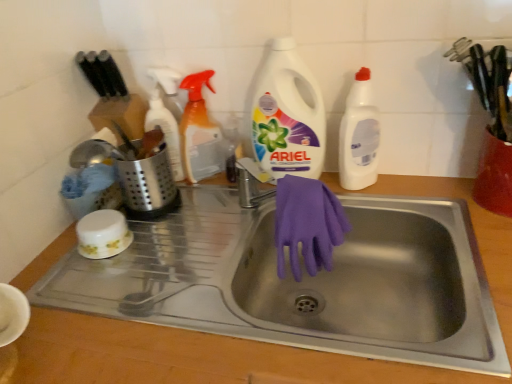
The width and height of the screenshot is (512, 384). What do you see at coordinates (359, 135) in the screenshot?
I see `white plastic bottle at upper right, the 1th cleaning product in the right-to-left sequence` at bounding box center [359, 135].

Measure the distance between point [144,207] and camera.

Point [144,207] is 37.17 inches from camera.

The image size is (512, 384). I want to click on satin silver utensil holder at left, marked as the 1th appliance in a left-to-right arrangement, so click(x=148, y=185).

How much space does red plastic container at upper right, the second appliance viewed from the left, occupy vertically?

6.27 inches.

You are a GUI agent. You are given a task and a screenshot of the screen. Output one action in this format:
    pyautogui.click(x=<x>, y=<y>)
    Task: Click on the purple rubber gloves at sink
    The width and height of the screenshot is (512, 384).
    Given the screenshot: What is the action you would take?
    pyautogui.click(x=307, y=224)

The width and height of the screenshot is (512, 384). What are the coordinates of `white plastic bottle at upper right, which is counted as the fourth cleaning product, starting from the left` in the screenshot? It's located at (359, 135).

Who is more distant, stainless steel sink at center or white plastic bottle at upper right, the 1th cleaning product in the right-to-left sequence?

white plastic bottle at upper right, the 1th cleaning product in the right-to-left sequence, is further away from the camera.

From the picture: Could you tell me if stainless steel sink at center is facing white plastic bottle at upper right, the 1th cleaning product in the right-to-left sequence?

No, stainless steel sink at center is not facing towards white plastic bottle at upper right, the 1th cleaning product in the right-to-left sequence.

Between stainless steel sink at center and white plastic bottle at upper right, which is counted as the fourth cleaning product, starting from the left, which one has smaller width?

white plastic bottle at upper right, which is counted as the fourth cleaning product, starting from the left, is thinner.

From the image's perspective, which object appears higher, stainless steel sink at center or white plastic bottle at upper right, which is counted as the fourth cleaning product, starting from the left?

From the image's view, white plastic bottle at upper right, which is counted as the fourth cleaning product, starting from the left, is above.

Considering the points (168, 83) and (189, 155), which point is behind, point (168, 83) or point (189, 155)?

The point (168, 83) is behind.

You are a GUI agent. You are given a task and a screenshot of the screen. Output one action in this format:
    pyautogui.click(x=<x>, y=<y>)
    Task: Click on the cleaning product directly beneath the translucent orange spray bottle at upper center, marked as the third cleaning product in a right-to-left arrangement (from a real-world perspective)
    The height and width of the screenshot is (384, 512).
    Given the screenshot: What is the action you would take?
    click(x=165, y=116)

Is translucent orange spray bottle at upper center, which appears as the second cleaning product when viewed from the left, at the back of translucent plastic spray bottle at upper center, positioned as the fourth cleaning product in right-to-left order?

That's not correct — translucent plastic spray bottle at upper center, positioned as the fourth cleaning product in right-to-left order, is not looking away from translucent orange spray bottle at upper center, which appears as the second cleaning product when viewed from the left.

Who is smaller, translucent plastic spray bottle at upper center, positioned as the 1th cleaning product in left-to-right order, or translucent orange spray bottle at upper center, marked as the third cleaning product in a right-to-left arrangement?

translucent plastic spray bottle at upper center, positioned as the 1th cleaning product in left-to-right order, is smaller.

Based on their positions, is white plastic detergent at center, marked as the 3th cleaning product in a left-to-right arrangement, located to the left or right of purple rubber gloves at sink?

white plastic detergent at center, marked as the 3th cleaning product in a left-to-right arrangement, is to the left of purple rubber gloves at sink.

Looking at this image, is white plastic detergent at center, acting as the 2th cleaning product starting from the right, taller than purple rubber gloves at sink?

Yes.

Is white plastic detergent at center, marked as the 3th cleaning product in a left-to-right arrangement, not within purple rubber gloves at sink?

That's correct, white plastic detergent at center, marked as the 3th cleaning product in a left-to-right arrangement, is outside of purple rubber gloves at sink.

Considering the sizes of objects stainless steel sink at center and translucent orange spray bottle at upper center, marked as the third cleaning product in a right-to-left arrangement, in the image provided, who is smaller, stainless steel sink at center or translucent orange spray bottle at upper center, marked as the third cleaning product in a right-to-left arrangement,?

translucent orange spray bottle at upper center, marked as the third cleaning product in a right-to-left arrangement.

From a real-world perspective, is stainless steel sink at center positioned under translucent orange spray bottle at upper center, which appears as the second cleaning product when viewed from the left, based on gravity?

Yes.

Is stainless steel sink at center looking in the opposite direction of translucent orange spray bottle at upper center, marked as the third cleaning product in a right-to-left arrangement?

No, stainless steel sink at center is not facing the opposite direction of translucent orange spray bottle at upper center, marked as the third cleaning product in a right-to-left arrangement.

Which object is further away from the camera, stainless steel sink at center or translucent orange spray bottle at upper center, which appears as the second cleaning product when viewed from the left?

translucent orange spray bottle at upper center, which appears as the second cleaning product when viewed from the left, is further away from the camera.

Is translucent plastic spray bottle at upper center, positioned as the 1th cleaning product in left-to-right order, turned away from white plastic detergent at center, acting as the 2th cleaning product starting from the right?

No.

Which is closer, (173, 156) or (314, 153)?

Positioned in front is point (314, 153).

Considering the relative positions of translucent plastic spray bottle at upper center, positioned as the 1th cleaning product in left-to-right order, and white plastic detergent at center, acting as the 2th cleaning product starting from the right, in the image provided, is translucent plastic spray bottle at upper center, positioned as the 1th cleaning product in left-to-right order, behind white plastic detergent at center, acting as the 2th cleaning product starting from the right,?

Yes, it is.

From the image's perspective, is translucent plastic spray bottle at upper center, positioned as the 1th cleaning product in left-to-right order, above or below white plastic detergent at center, acting as the 2th cleaning product starting from the right?

translucent plastic spray bottle at upper center, positioned as the 1th cleaning product in left-to-right order, is situated lower than white plastic detergent at center, acting as the 2th cleaning product starting from the right, in the image.

Considering the relative positions of red plastic container at upper right, the second appliance viewed from the left, and translucent orange spray bottle at upper center, marked as the third cleaning product in a right-to-left arrangement, in the image provided, is red plastic container at upper right, the second appliance viewed from the left, to the left or to the right of translucent orange spray bottle at upper center, marked as the third cleaning product in a right-to-left arrangement,?

In the image, red plastic container at upper right, the second appliance viewed from the left, appears on the right side of translucent orange spray bottle at upper center, marked as the third cleaning product in a right-to-left arrangement.

Consider the image. What's the angular difference between red plastic container at upper right, the 1th appliance viewed from the right, and translucent orange spray bottle at upper center, which appears as the second cleaning product when viewed from the left,'s facing directions?

They differ by 0.00111 degrees in their facing directions.

From a real-world perspective, which is physically below, red plastic container at upper right, the second appliance viewed from the left, or translucent orange spray bottle at upper center, marked as the third cleaning product in a right-to-left arrangement?

red plastic container at upper right, the second appliance viewed from the left, is physically lower.

From the image's perspective, which is above, red plastic container at upper right, the second appliance viewed from the left, or translucent orange spray bottle at upper center, which appears as the second cleaning product when viewed from the left?

From the image's view, translucent orange spray bottle at upper center, which appears as the second cleaning product when viewed from the left, is above.

Is purple rubber gloves at sink taller or shorter than stainless steel sink at center?

Considering their sizes, purple rubber gloves at sink has less height than stainless steel sink at center.

How different are the orientations of purple rubber gloves at sink and stainless steel sink at center in degrees?

There is a 2.27-degree angle between the facing directions of purple rubber gloves at sink and stainless steel sink at center.

Based on the photo, is stainless steel sink at center located within purple rubber gloves at sink?

Definitely not — stainless steel sink at center is not inside purple rubber gloves at sink.

How distant is purple rubber gloves at sink from stainless steel sink at center?

purple rubber gloves at sink is 9.12 inches away from stainless steel sink at center.

The width and height of the screenshot is (512, 384). I want to click on sink that appears below the white plastic bottle at upper right, the 1th cleaning product in the right-to-left sequence (from the image's perspective), so click(x=176, y=314).

This screenshot has height=384, width=512. Identify the location of cleaning product that appears below the translucent orange spray bottle at upper center, which appears as the second cleaning product when viewed from the left (from a real-world perspective). (165, 116).

Based on their spatial positions, is red plastic container at upper right, the 1th appliance viewed from the right, or purple rubber gloves at sink closer to satin silver utensil holder at left, marked as the 1th appliance in a left-to-right arrangement?

purple rubber gloves at sink is closer to satin silver utensil holder at left, marked as the 1th appliance in a left-to-right arrangement.

When comparing their distances from white plastic bottle at upper right, which is counted as the fourth cleaning product, starting from the left, does stainless steel sink at center or red plastic container at upper right, the second appliance viewed from the left, seem further?

stainless steel sink at center is further to white plastic bottle at upper right, which is counted as the fourth cleaning product, starting from the left.

Looking at the image, which one is located closer to white plastic bottle at upper right, which is counted as the fourth cleaning product, starting from the left, stainless steel sink at center or satin silver utensil holder at left, marked as the 1th appliance in a left-to-right arrangement?

Among the two, stainless steel sink at center is located nearer to white plastic bottle at upper right, which is counted as the fourth cleaning product, starting from the left.

Which object lies further to the anchor point white plastic bottle at upper right, the 1th cleaning product in the right-to-left sequence, translucent plastic spray bottle at upper center, positioned as the fourth cleaning product in right-to-left order, or red plastic container at upper right, the second appliance viewed from the left?

translucent plastic spray bottle at upper center, positioned as the fourth cleaning product in right-to-left order, lies further to white plastic bottle at upper right, the 1th cleaning product in the right-to-left sequence, than the other object.

When comparing their distances from white plastic detergent at center, acting as the 2th cleaning product starting from the right, does white plastic bottle at upper right, which is counted as the fourth cleaning product, starting from the left, or red plastic container at upper right, the second appliance viewed from the left, seem closer?

Among the two, white plastic bottle at upper right, which is counted as the fourth cleaning product, starting from the left, is located nearer to white plastic detergent at center, acting as the 2th cleaning product starting from the right.

Based on their spatial positions, is satin silver utensil holder at left, which is counted as the 2th appliance, starting from the right, or white plastic bottle at upper right, which is counted as the fourth cleaning product, starting from the left, further from white plastic detergent at center, acting as the 2th cleaning product starting from the right?

satin silver utensil holder at left, which is counted as the 2th appliance, starting from the right, lies further to white plastic detergent at center, acting as the 2th cleaning product starting from the right, than the other object.

When comparing their distances from white plastic detergent at center, acting as the 2th cleaning product starting from the right, does satin silver utensil holder at left, which is counted as the 2th appliance, starting from the right, or red plastic container at upper right, the second appliance viewed from the left, seem further?

red plastic container at upper right, the second appliance viewed from the left, is positioned further to the anchor white plastic detergent at center, acting as the 2th cleaning product starting from the right.

Estimate the real-world distances between objects in this image. Which object is closer to red plastic container at upper right, the second appliance viewed from the left, satin silver utensil holder at left, marked as the 1th appliance in a left-to-right arrangement, or stainless steel sink at center?

stainless steel sink at center.

This screenshot has width=512, height=384. I want to click on glove between translucent plastic spray bottle at upper center, positioned as the 1th cleaning product in left-to-right order, and stainless steel sink at center, in the vertical direction, so click(x=307, y=224).

You are a GUI agent. You are given a task and a screenshot of the screen. Output one action in this format:
    pyautogui.click(x=<x>, y=<y>)
    Task: Click on the glove between satin silver utensil holder at left, marked as the 1th appliance in a left-to-right arrangement, and white plastic bottle at upper right, the 1th cleaning product in the right-to-left sequence, in the horizontal direction
    
    Given the screenshot: What is the action you would take?
    pyautogui.click(x=307, y=224)

Identify the location of glove between translucent orange spray bottle at upper center, marked as the third cleaning product in a right-to-left arrangement, and white plastic bottle at upper right, which is counted as the fourth cleaning product, starting from the left, in the horizontal direction. Image resolution: width=512 pixels, height=384 pixels. (307, 224).

I want to click on glove between translucent orange spray bottle at upper center, marked as the third cleaning product in a right-to-left arrangement, and stainless steel sink at center from top to bottom, so click(307, 224).